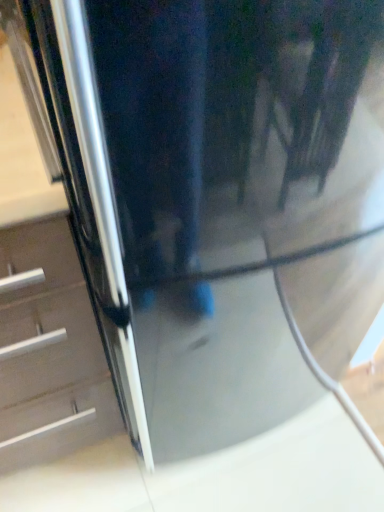
Describe the element at coordinates (49, 351) in the screenshot. The width and height of the screenshot is (384, 512). I see `satin silver drawer at left` at that location.

Locate an element on the screen. The width and height of the screenshot is (384, 512). satin silver drawer at left is located at coordinates (49, 351).

Measure the distance between point (x=59, y=288) and camera.

Point (x=59, y=288) and camera are 64.70 centimeters apart.

Image resolution: width=384 pixels, height=512 pixels. I want to click on satin silver drawer at left, so click(x=49, y=351).